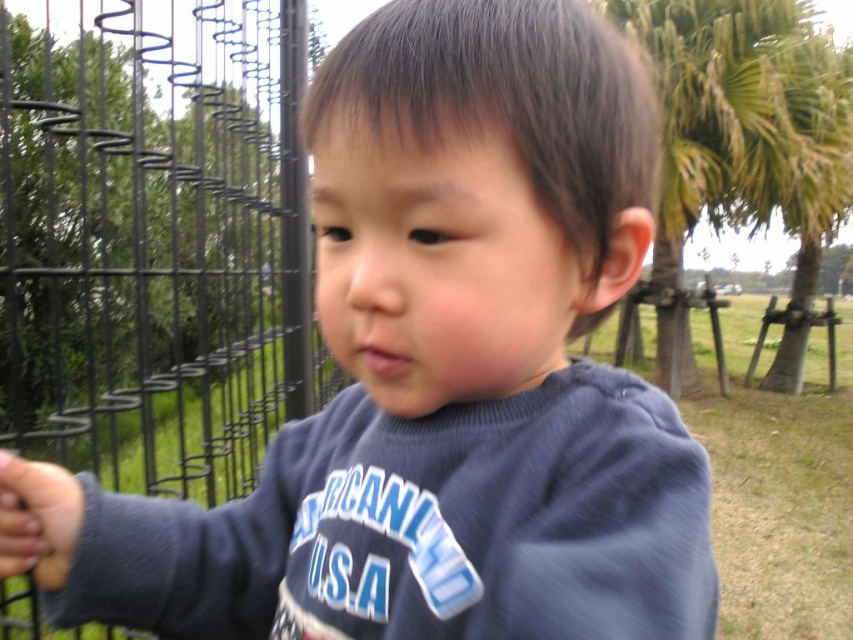
Question: Which point is closer to the camera taking this photo?

Choices:
 (A) (286, 378)
 (B) (805, 154)

Answer: (A)

Question: Is black wire fence at left further to camera compared to green leafy palm tree at upper right?

Choices:
 (A) no
 (B) yes

Answer: (A)

Question: Is black wire fence at left to the left of green leafy palm tree at upper right from the viewer's perspective?

Choices:
 (A) no
 (B) yes

Answer: (B)

Question: Among these points, which one is farthest from the camera?

Choices:
 (A) (238, 406)
 (B) (666, 228)

Answer: (B)

Question: Does black wire fence at left appear on the right side of green leafy palm tree at upper right?

Choices:
 (A) yes
 (B) no

Answer: (B)

Question: Which object is farther from the camera taking this photo?

Choices:
 (A) green leafy palm tree at upper right
 (B) black wire fence at left

Answer: (A)